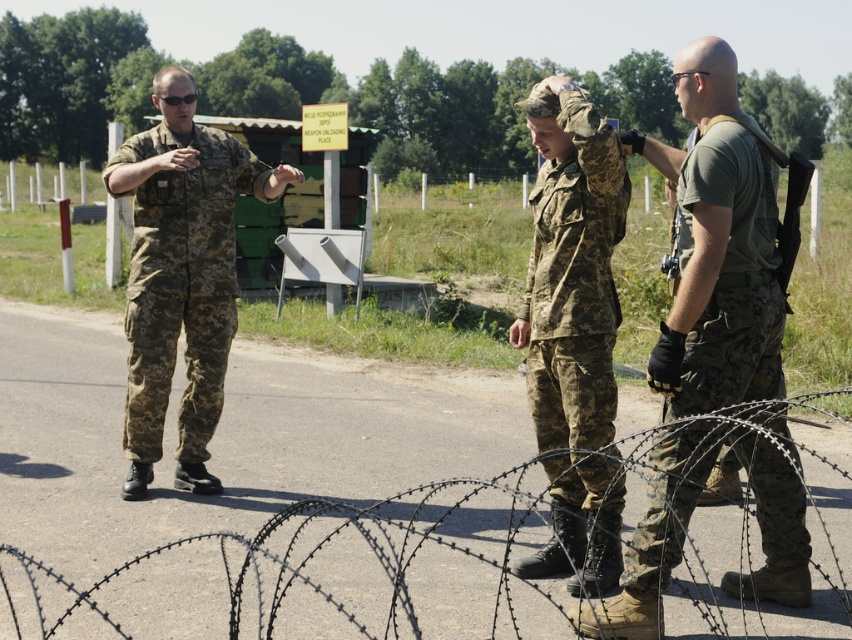
Is barbed wire at center thinner than camouflage fabric uniform at left?

No.

Can you confirm if barbed wire at center is positioned to the left of camouflage fabric uniform at left?

No, barbed wire at center is not to the left of camouflage fabric uniform at left.

You are a GUI agent. You are given a task and a screenshot of the screen. Output one action in this format:
    pyautogui.click(x=<x>, y=<y>)
    Task: Click on the barbed wire at center
    The image size is (852, 640).
    Given the screenshot: What is the action you would take?
    pyautogui.click(x=298, y=568)

You are a GUI agent. You are given a task and a screenshot of the screen. Output one action in this format:
    pyautogui.click(x=<x>, y=<y>)
    Task: Click on the barbed wire at center
    
    Given the screenshot: What is the action you would take?
    pyautogui.click(x=298, y=568)

Where is `barbed wire at center`? barbed wire at center is located at coordinates (298, 568).

Is point (83, 572) closer to camera compared to point (534, 90)?

No, (83, 572) is behind (534, 90).

In order to click on barbed wire at center in this screenshot , I will do `click(298, 568)`.

Between point (210, 634) and point (686, 465), which one is positioned in front?

Point (686, 465) is more forward.

Who is shorter, barbed wire at center or camouflage uniform at center?

barbed wire at center

Does point (532, 499) come in front of point (711, 429)?

That is False.

This screenshot has height=640, width=852. In order to click on barbed wire at center in this screenshot , I will do `click(298, 568)`.